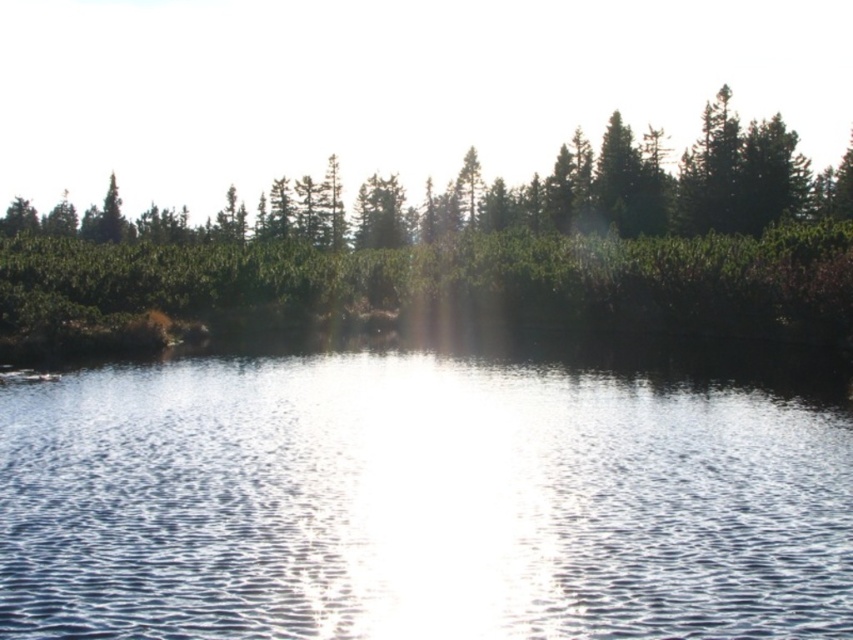
Who is positioned more to the left, clear water at center or green textured foliage at upper center?

From the viewer's perspective, green textured foliage at upper center appears more on the left side.

Can you confirm if clear water at center is smaller than green textured foliage at upper center?

Yes.

Between point (311, 618) and point (76, 308), which one is positioned behind?

The point (76, 308) is behind.

You are a GUI agent. You are given a task and a screenshot of the screen. Output one action in this format:
    pyautogui.click(x=<x>, y=<y>)
    Task: Click on the clear water at center
    Image resolution: width=853 pixels, height=640 pixels.
    Given the screenshot: What is the action you would take?
    pyautogui.click(x=431, y=492)